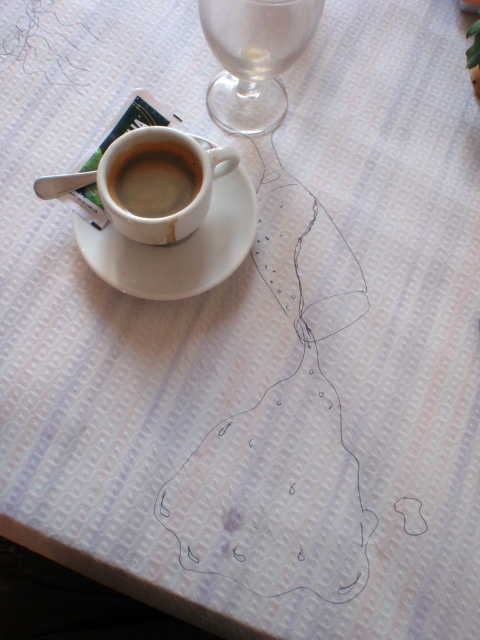
You are looking at the table setting and want to place a napkin between the two points on the table, point (255, 202) and point (156, 195). Which point should you place the napkin closer to so that it appears closer to you?

You should place the napkin closer to point (255, 202) because it is further to the viewer than point (156, 195), making it appear closer.

You are setting up a table for a dinner party and have both a transparent glass wine glass at upper right and a matte ceramic cup at center. Which object should you choose if you need a larger container for a beverage?

The transparent glass wine glass at upper right is larger in size than the matte ceramic cup at center, so you should choose the transparent glass wine glass at upper right for a larger beverage container.